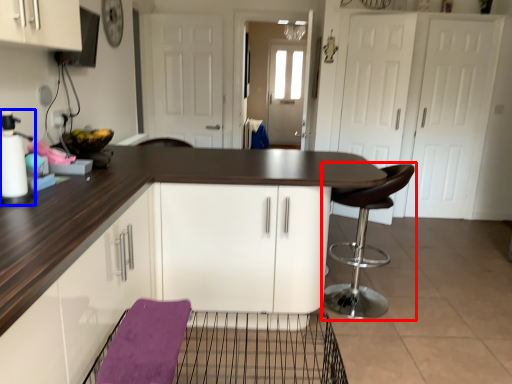
Question: Which of the following is the closest to the observer, chair (highlighted by a red box) or appliance (highlighted by a blue box)?

Choices:
 (A) chair
 (B) appliance

Answer: (B)